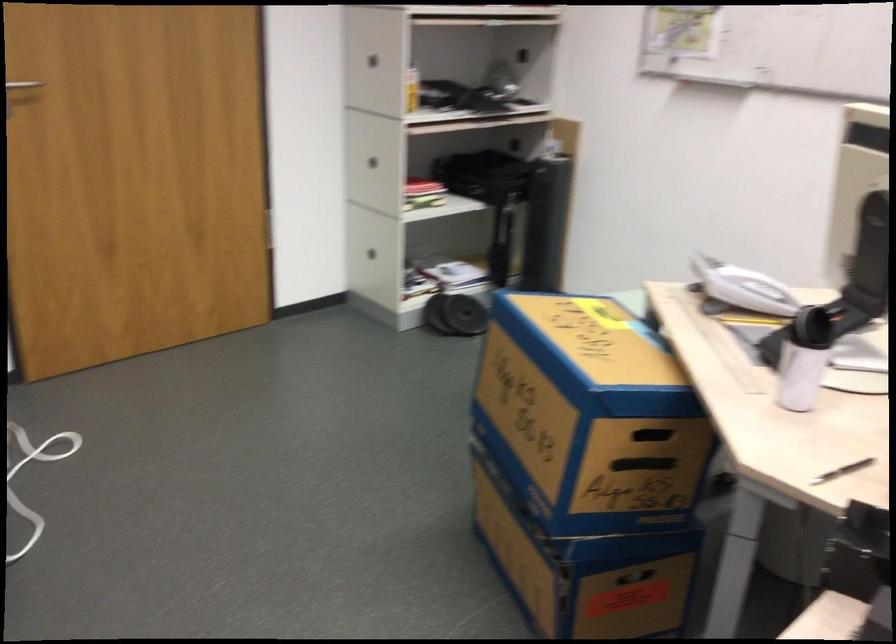
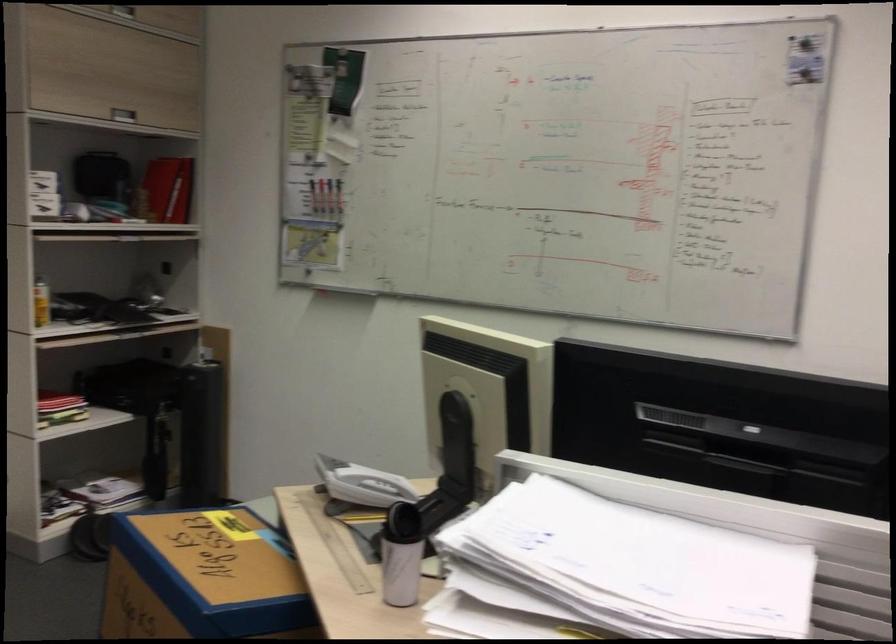
In the second image, find the point that corresponds to pixel 806 377 in the first image.

(400, 570)